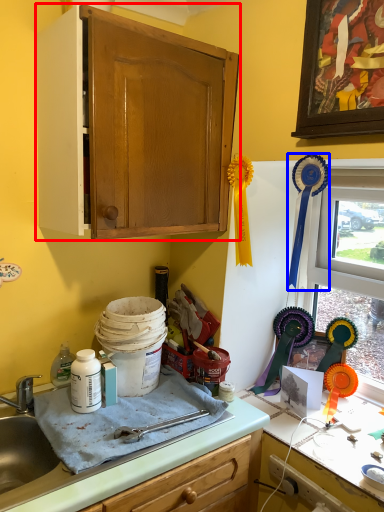
Question: Among these objects, which one is nearest to the camera, cabinetry (highlighted by a red box) or brush (highlighted by a blue box)?

Choices:
 (A) cabinetry
 (B) brush

Answer: (A)